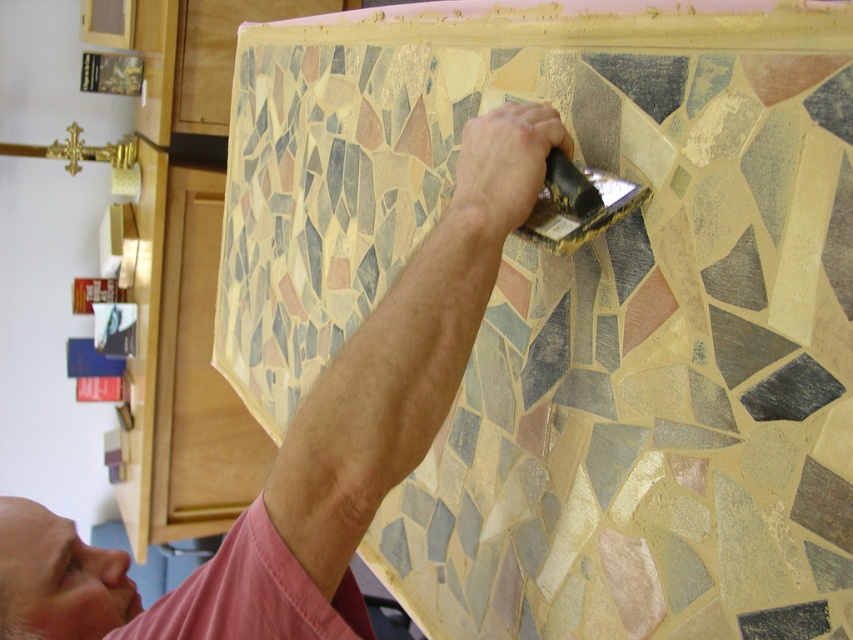
Question: Estimate the real-world distances between objects in this image. Which object is farther from the gold metallic putty knife at upper center?

Choices:
 (A) pink cotton shirt at upper center
 (B) multicolored mosaic tile at upper center

Answer: (B)

Question: Can you confirm if multicolored mosaic tile at upper center is bigger than pink cotton shirt at upper center?

Choices:
 (A) no
 (B) yes

Answer: (B)

Question: Does multicolored mosaic tile at upper center lie in front of gold metallic putty knife at upper center?

Choices:
 (A) yes
 (B) no

Answer: (A)

Question: Among these objects, which one is farthest from the camera?

Choices:
 (A) multicolored mosaic tile at upper center
 (B) gold metallic putty knife at upper center

Answer: (B)

Question: Does multicolored mosaic tile at upper center appear on the right side of pink fabric shirt at upper center?

Choices:
 (A) yes
 (B) no

Answer: (B)

Question: Which object appears closest to the camera in this image?

Choices:
 (A) multicolored mosaic tile at upper center
 (B) gold metallic putty knife at upper center

Answer: (A)